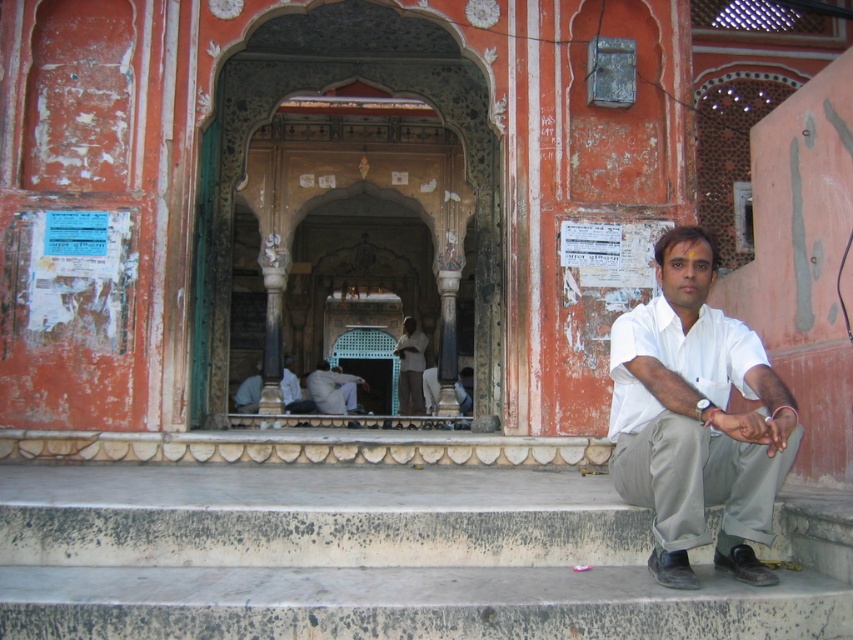
Describe the element at coordinates (695, 419) in the screenshot. Image resolution: width=853 pixels, height=640 pixels. I see `white matte shirt at lower right` at that location.

Who is more forward, (x=747, y=481) or (x=334, y=365)?

Positioned in front is point (x=747, y=481).

Measure the distance between point (729,337) and camera.

A distance of 11.22 meters exists between point (729,337) and camera.

I want to click on white matte shirt at lower right, so click(x=695, y=419).

Based on the photo, which is more to the left, white matte shirt at lower right or light gray fabric at center?

Positioned to the left is light gray fabric at center.

Image resolution: width=853 pixels, height=640 pixels. I want to click on white matte shirt at lower right, so click(695, 419).

Does white matte shirt at lower right appear over light brown wooden bench at center?

Indeed, white matte shirt at lower right is positioned over light brown wooden bench at center.

Who is shorter, white matte shirt at lower right or light brown wooden bench at center?

light brown wooden bench at center

Between point (660, 330) and point (294, 404), which one is positioned in front?

Positioned in front is point (660, 330).

Identify the location of white matte shirt at lower right. (695, 419).